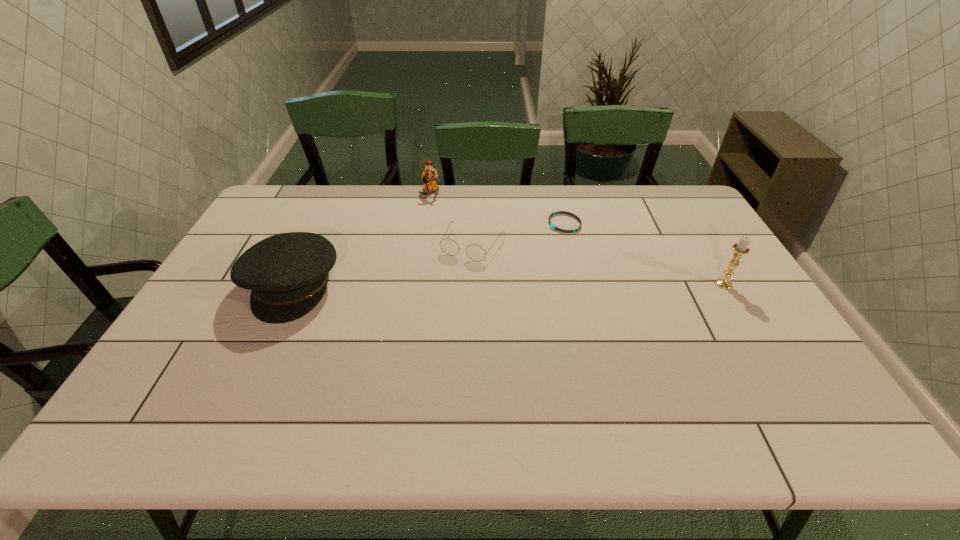
What are the coordinates of `blank area located on the left of the tallest object` in the screenshot? It's located at (619, 284).

Identify the location of vacant space situated on the buckle of the wristband. The width and height of the screenshot is (960, 540). tap(525, 245).

Locate an element on the screen. free space located on the buckle of the wristband is located at coordinates (487, 265).

You are a GUI agent. You are given a task and a screenshot of the screen. Output one action in this format:
    pyautogui.click(x=<x>, y=<y>)
    Task: Click on the free point located 0.150m on the buckle of the wristband
    This screenshot has width=960, height=540.
    Given the screenshot: What is the action you would take?
    point(520,247)

This screenshot has height=540, width=960. I want to click on vacant space located 0.380m on the temples of the third object from left to right, so click(405, 356).

The width and height of the screenshot is (960, 540). Find the location of `vacant space situated 0.260m on the temples of the third object from left to right`. vacant space situated 0.260m on the temples of the third object from left to right is located at coordinates (426, 322).

I want to click on free spot located 0.120m on the temples of the third object from left to right, so click(446, 288).

Locate an element on the screen. free region located holding a crossbow in the hands of the farthest object is located at coordinates (444, 214).

The width and height of the screenshot is (960, 540). Identify the location of vacant region located 0.290m holding a crossbow in the hands of the farthest object. (468, 245).

The height and width of the screenshot is (540, 960). I want to click on vacant space located 0.170m holding a crossbow in the hands of the farthest object, so click(x=453, y=226).